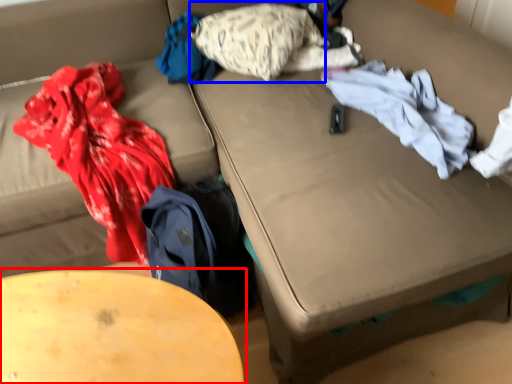
Question: Which point is further to the camera, table (highlighted by a red box) or pillow (highlighted by a blue box)?

Choices:
 (A) table
 (B) pillow

Answer: (B)